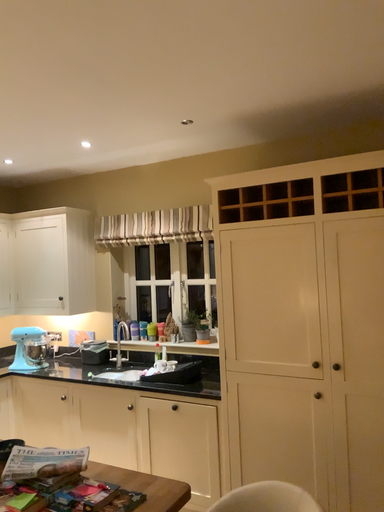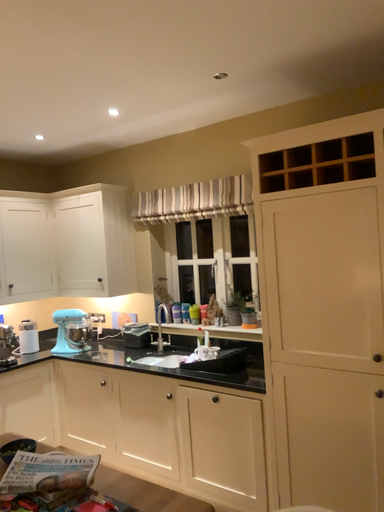
Question: How did the camera likely rotate when shooting the video?

Choices:
 (A) rotated left
 (B) rotated right

Answer: (A)